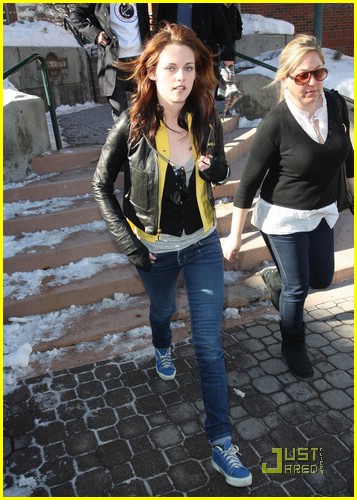
Image resolution: width=357 pixels, height=500 pixels. Identify the location of stair. (117, 340), (107, 318), (97, 279), (80, 241), (77, 211), (71, 177), (80, 146).